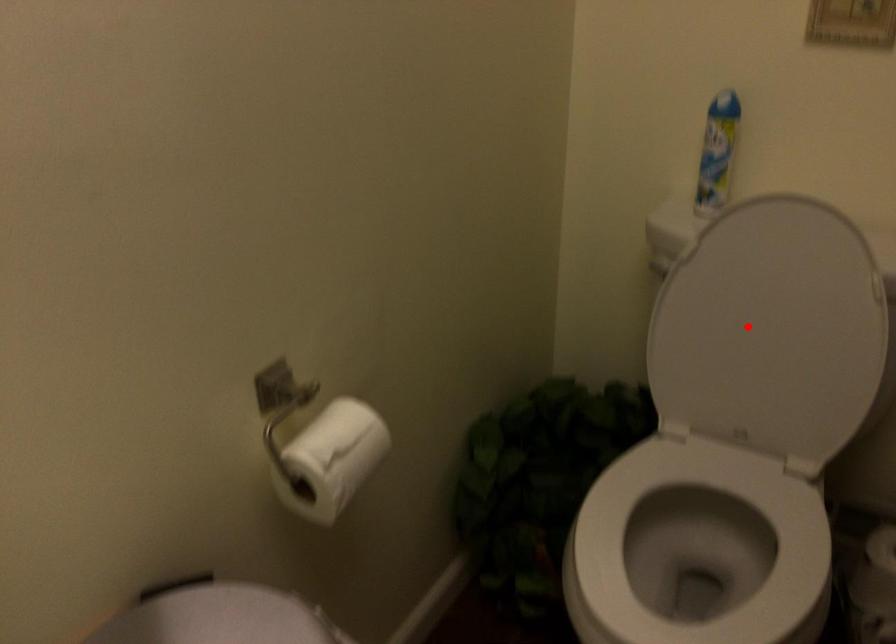
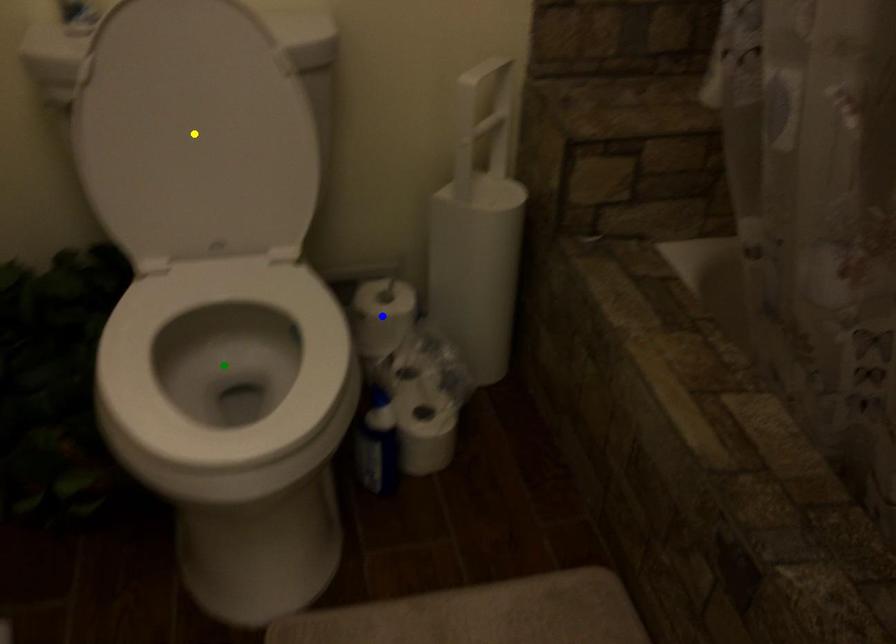
Question: I am providing you with two images of the same scene from different viewpoints. A red point is marked on the first image. You are given multiple points on the second image. Can you choose the point in image 2 that corresponds to the point in image 1?

Choices:
 (A) blue point
 (B) green point
 (C) yellow point

Answer: (C)